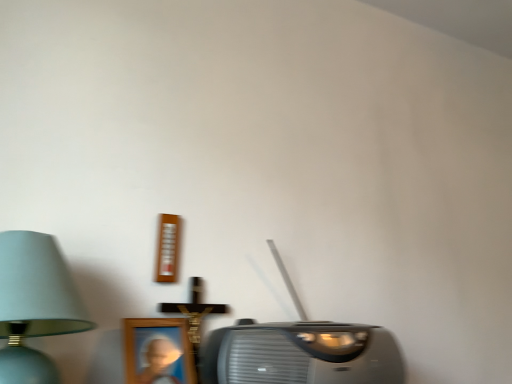
The height and width of the screenshot is (384, 512). Find the location of `light blue fabric lampshade at left`. light blue fabric lampshade at left is located at coordinates (34, 304).

What do you see at coordinates (34, 304) in the screenshot?
I see `light blue fabric lampshade at left` at bounding box center [34, 304].

Where is `metallic gray stereo at center`? metallic gray stereo at center is located at coordinates (302, 354).

The height and width of the screenshot is (384, 512). What do you see at coordinates (302, 354) in the screenshot?
I see `metallic gray stereo at center` at bounding box center [302, 354].

Identify the location of light blue fabric lampshade at left. (34, 304).

Which is more to the right, light blue fabric lampshade at left or metallic gray stereo at center?

metallic gray stereo at center.

In the image, is light blue fabric lampshade at left positioned in front of or behind metallic gray stereo at center?

light blue fabric lampshade at left is positioned closer to the viewer than metallic gray stereo at center.

Between point (75, 327) and point (256, 382), which one is positioned in front?

Point (256, 382)

From the image's perspective, relative to metallic gray stereo at center, is light blue fabric lampshade at left above or below?

From the image's perspective, light blue fabric lampshade at left appears above metallic gray stereo at center.

From a real-world perspective, does light blue fabric lampshade at left sit lower than metallic gray stereo at center?

No, from a real-world perspective, light blue fabric lampshade at left is not under metallic gray stereo at center.

Can you confirm if light blue fabric lampshade at left is wider than metallic gray stereo at center?

Yes.

Considering the sizes of objects light blue fabric lampshade at left and metallic gray stereo at center in the image provided, who is shorter, light blue fabric lampshade at left or metallic gray stereo at center?

metallic gray stereo at center is shorter.

In the scene shown: Considering the relative sizes of light blue fabric lampshade at left and metallic gray stereo at center in the image provided, is light blue fabric lampshade at left bigger than metallic gray stereo at center?

No, light blue fabric lampshade at left is not bigger than metallic gray stereo at center.

Is metallic gray stereo at center surrounded by light blue fabric lampshade at left?

No, metallic gray stereo at center is not a part of light blue fabric lampshade at left.

Is the surface of light blue fabric lampshade at left in direct contact with metallic gray stereo at center?

There is a gap between light blue fabric lampshade at left and metallic gray stereo at center.

Does light blue fabric lampshade at left turn towards metallic gray stereo at center?

No, light blue fabric lampshade at left is not turned towards metallic gray stereo at center.

You are a GUI agent. You are given a task and a screenshot of the screen. Output one action in this format:
    pyautogui.click(x=<x>, y=<y>)
    Task: Click on the stereo that appears below the light blue fabric lampshade at left (from a real-world perspective)
    The height and width of the screenshot is (384, 512).
    Given the screenshot: What is the action you would take?
    pyautogui.click(x=302, y=354)

Would you say metallic gray stereo at center is to the left or to the right of light blue fabric lampshade at left in the picture?

Based on their positions, metallic gray stereo at center is located to the right of light blue fabric lampshade at left.

Is the depth of metallic gray stereo at center greater than that of light blue fabric lampshade at left?

Yes, it is behind light blue fabric lampshade at left.

Is point (287, 380) positioned behind point (62, 265)?

No.

From the image's perspective, who appears lower, metallic gray stereo at center or light blue fabric lampshade at left?

metallic gray stereo at center appears lower in the image.

From a real-world perspective, is metallic gray stereo at center below light blue fabric lampshade at left?

Yes, from a real-world perspective, metallic gray stereo at center is under light blue fabric lampshade at left.

Which object is wider, metallic gray stereo at center or light blue fabric lampshade at left?

With larger width is light blue fabric lampshade at left.

Between metallic gray stereo at center and light blue fabric lampshade at left, which one has more height?

light blue fabric lampshade at left.

Is metallic gray stereo at center bigger than light blue fabric lampshade at left?

Indeed, metallic gray stereo at center has a larger size compared to light blue fabric lampshade at left.

Can light blue fabric lampshade at left be found inside metallic gray stereo at center?

Definitely not — light blue fabric lampshade at left is not inside metallic gray stereo at center.

Is metallic gray stereo at center far away from light blue fabric lampshade at left?

metallic gray stereo at center is near light blue fabric lampshade at left, not far away.

Is light blue fabric lampshade at left at the back of metallic gray stereo at center?

That's not correct — metallic gray stereo at center is not looking away from light blue fabric lampshade at left.

Can you tell me how much metallic gray stereo at center and light blue fabric lampshade at left differ in facing direction?

They differ by 2.13 degrees in their facing directions.

Locate an element on the screen. stereo on the right of light blue fabric lampshade at left is located at coordinates (302, 354).

Where is `lamp above the metallic gray stereo at center (from a real-world perspective)`? This screenshot has height=384, width=512. lamp above the metallic gray stereo at center (from a real-world perspective) is located at coordinates (34, 304).

Find the location of a particular element. The image size is (512, 384). lamp located on the left of metallic gray stereo at center is located at coordinates (34, 304).